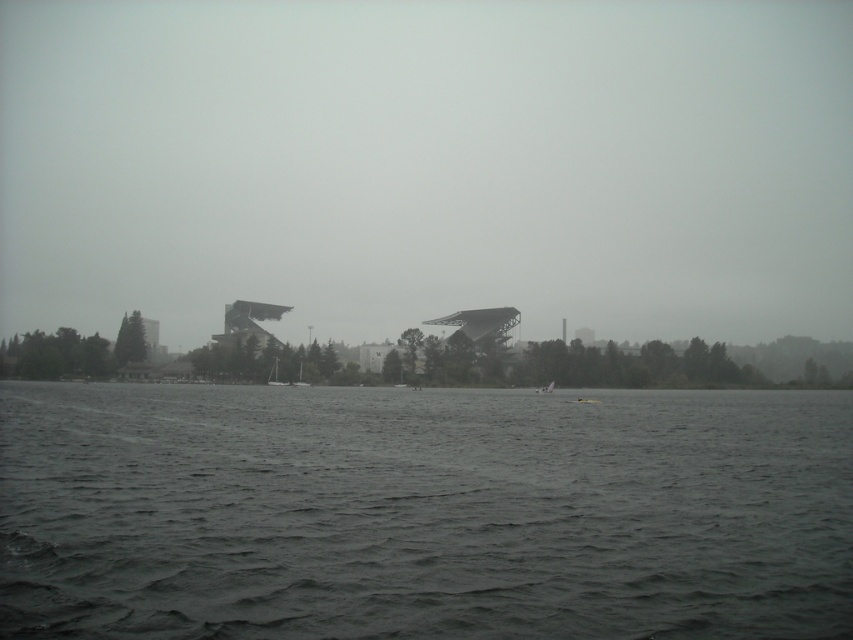
Question: Which object appears closest to the camera in this image?

Choices:
 (A) white plastic boat at center
 (B) foggy sky at center
 (C) dark gray water at center

Answer: (C)

Question: Does white plastic sailboat at center come behind white matte sailboat at center?

Choices:
 (A) yes
 (B) no

Answer: (A)

Question: Which is farther from the white plastic boat at center?

Choices:
 (A) white matte sailboat at center
 (B) dark gray water at center
 (C) foggy sky at center
 (D) white plastic sailboat at center

Answer: (C)

Question: Observing the image, what is the correct spatial positioning of dark gray water at center in reference to white plastic sailboat at center?

Choices:
 (A) right
 (B) left

Answer: (A)

Question: Is foggy sky at center positioned behind white matte sailboat at center?

Choices:
 (A) yes
 (B) no

Answer: (A)

Question: Estimate the real-world distances between objects in this image. Which object is closer to the foggy sky at center?

Choices:
 (A) white plastic boat at center
 (B) white matte sailboat at center
 (C) white plastic sailboat at center

Answer: (C)